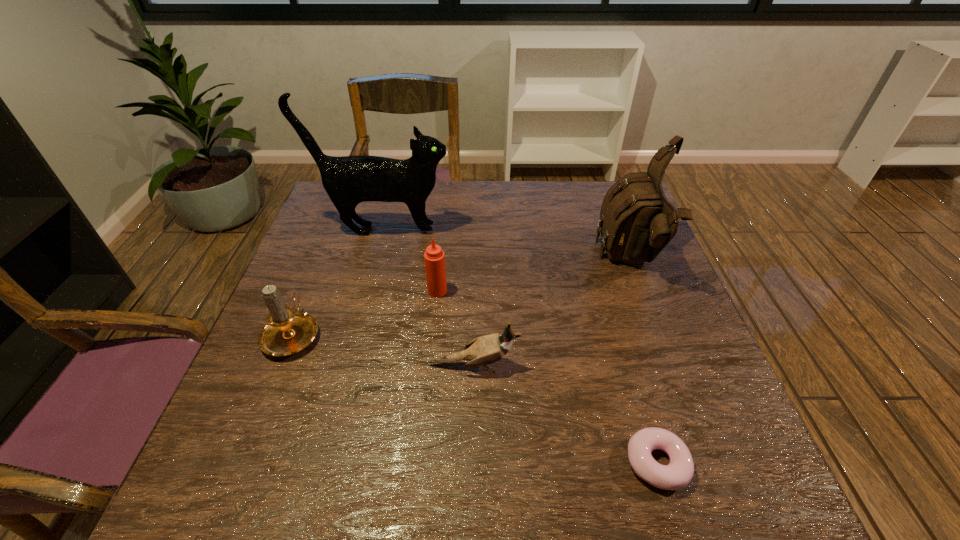
You are a GUI agent. You are given a task and a screenshot of the screen. Output one action in this format:
    pyautogui.click(x=<x>, y=<y>)
    Task: Click on the vacant space located 0.310m on the front-facing side of the second tallest object
    The height and width of the screenshot is (540, 960).
    Given the screenshot: What is the action you would take?
    pyautogui.click(x=484, y=261)

Locate an element on the screen. The image size is (960, 540). free space located on the back of the candle is located at coordinates (331, 239).

Locate an element on the screen. vacant area located 0.310m on the front of the Tabasco sauce is located at coordinates (425, 412).

At what (x,y) coordinates should I click in order to perform the action: click on vacant space positioned at the face of the bird. Please return your answer as a coordinate pair (x, y). The image size is (960, 540). Looking at the image, I should click on (576, 365).

Locate an element on the screen. vacant region located on the left of the doughnut is located at coordinates (468, 463).

The width and height of the screenshot is (960, 540). Find the location of `object at the far edge`. object at the far edge is located at coordinates (349, 180).

The height and width of the screenshot is (540, 960). Find the location of `object located at the near edge`. object located at the near edge is located at coordinates (677, 474).

Find the location of a particular element. Image resolution: width=960 pixels, height=540 pixels. cat at the left edge is located at coordinates (349, 180).

Where is `candle present at the left edge`? The height and width of the screenshot is (540, 960). candle present at the left edge is located at coordinates (286, 332).

This screenshot has height=540, width=960. I want to click on shoulder bag that is positioned at the right edge, so click(637, 221).